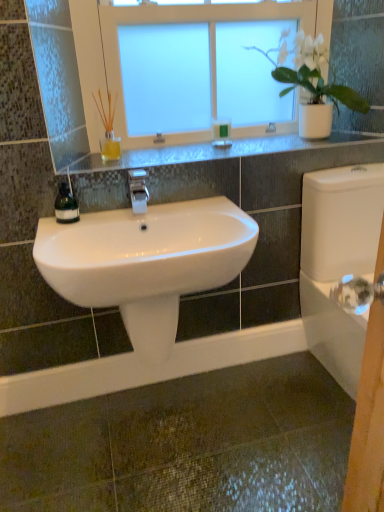
The height and width of the screenshot is (512, 384). What do you see at coordinates (66, 205) in the screenshot?
I see `green matte soap dispenser at left` at bounding box center [66, 205].

Where is `green matte soap at upper center`? Image resolution: width=384 pixels, height=512 pixels. green matte soap at upper center is located at coordinates (221, 134).

Describe the element at coordinates (338, 261) in the screenshot. I see `white glossy porcelain at right` at that location.

What is the approximate height of white matte pot at upper right?

16.82 inches.

What are the coordinates of `green matte soap dispenser at left` in the screenshot? It's located at (66, 205).

Is point (262, 53) less distant than point (358, 268)?

No, (262, 53) is further to viewer.

From a real-world perspective, which is physically below, white matte pot at upper right or white glossy porcelain at right?

white glossy porcelain at right.

Is white matte pot at upper right beside white glossy porcelain at right?

white matte pot at upper right and white glossy porcelain at right are clearly separated.

From the image's perspective, would you say white matte pot at upper right is positioned over white glossy porcelain at right?

Yes, from the image's perspective, white matte pot at upper right is on top of white glossy porcelain at right.

Does white frosted glass window at upper center come behind green matte soap at upper center?

No, white frosted glass window at upper center is closer to the camera.

Considering the sizes of objects white frosted glass window at upper center and green matte soap at upper center in the image provided, who is taller, white frosted glass window at upper center or green matte soap at upper center?

With more height is white frosted glass window at upper center.

Based on the photo, is white frosted glass window at upper center facing towards green matte soap at upper center?

Yes, white frosted glass window at upper center is turned towards green matte soap at upper center.

Looking at the image, does white frosted glass window at upper center seem bigger or smaller compared to green matte soap at upper center?

In the image, white frosted glass window at upper center appears to be larger than green matte soap at upper center.

Does white matte pot at upper right have a greater width compared to white frosted glass window at upper center?

Yes.

Which is correct: white matte pot at upper right is inside white frosted glass window at upper center, or outside of it?

white matte pot at upper right exists outside the volume of white frosted glass window at upper center.

Which object is positioned more to the left, white matte pot at upper right or white frosted glass window at upper center?

From the viewer's perspective, white frosted glass window at upper center appears more on the left side.

From the image's perspective, is white glossy sink at center positioned above or below green matte soap dispenser at left?

From the image's perspective, white glossy sink at center appears below green matte soap dispenser at left.

Is white glossy sink at center not close to green matte soap dispenser at left?

No, white glossy sink at center is not far away from green matte soap dispenser at left.

In the scene shown: Is white glossy sink at center turned away from green matte soap dispenser at left?

No, green matte soap dispenser at left is not at the back of white glossy sink at center.

What's the angular difference between white glossy sink at center and green matte soap dispenser at left's facing directions?

The facing directions of white glossy sink at center and green matte soap dispenser at left are 3.4 degrees apart.

Could you tell me if green matte soap dispenser at left is facing white matte pot at upper right?

No, green matte soap dispenser at left is not facing towards white matte pot at upper right.

From the image's perspective, would you say green matte soap dispenser at left is positioned over white matte pot at upper right?

Actually, green matte soap dispenser at left appears below white matte pot at upper right in the image.

From a real-world perspective, is green matte soap dispenser at left beneath white matte pot at upper right?

Yes, from a real-world perspective, green matte soap dispenser at left is below white matte pot at upper right.

Can you tell me how much green matte soap dispenser at left and white matte pot at upper right differ in facing direction?

There is a 2.65-degree angle between the facing directions of green matte soap dispenser at left and white matte pot at upper right.

Based on the photo, is green matte soap dispenser at left at the back of white glossy porcelain at right?

No, green matte soap dispenser at left is not at the back of white glossy porcelain at right.

Considering the sizes of objects white glossy porcelain at right and green matte soap dispenser at left in the image provided, who is shorter, white glossy porcelain at right or green matte soap dispenser at left?

green matte soap dispenser at left is shorter.

Is white glossy porcelain at right located outside green matte soap dispenser at left?

Indeed, white glossy porcelain at right is completely outside green matte soap dispenser at left.

Is white glossy porcelain at right looking in the opposite direction of satin silver shelf at upper center?

No, white glossy porcelain at right's orientation is not away from satin silver shelf at upper center.

Can we say white glossy porcelain at right lies outside satin silver shelf at upper center?

Indeed, white glossy porcelain at right is completely outside satin silver shelf at upper center.

Consider the image. Considering the sizes of white glossy porcelain at right and satin silver shelf at upper center in the image, is white glossy porcelain at right taller or shorter than satin silver shelf at upper center?

Considering their sizes, white glossy porcelain at right has more height than satin silver shelf at upper center.

Identify the location of houseplant on the left of white glossy porcelain at right. (311, 73).

You are a GUI agent. You are given a task and a screenshot of the screen. Output one action in this format:
    pyautogui.click(x=<x>, y=<y>)
    Task: Click on the window above the green matte soap at upper center (from a real-world perspective)
    
    Given the screenshot: What is the action you would take?
    pyautogui.click(x=188, y=23)

When comparing their distances from white glossy faucet at center, does white frosted glass window at upper center or white glossy sink at center seem further?

Based on the image, white frosted glass window at upper center appears to be further to white glossy faucet at center.

Considering their positions, is white glossy sink at center positioned closer to white frosted glass window at upper center than satin silver shelf at upper center?

satin silver shelf at upper center is positioned closer to the anchor white frosted glass window at upper center.

Consider the image. Which object lies further to the anchor point green matte soap at upper center, white glossy sink at center or white glossy porcelain at right?

Based on the image, white glossy porcelain at right appears to be further to green matte soap at upper center.

Consider the image. Based on their spatial positions, is white matte pot at upper right or green matte soap dispenser at left closer to white glossy porcelain at right?

The object closer to white glossy porcelain at right is white matte pot at upper right.

From the image, which object appears to be nearer to white glossy sink at center, white frosted glass window at upper center or white glossy faucet at center?

white glossy faucet at center.

Looking at the image, which one is located closer to green matte soap dispenser at left, white matte pot at upper right or green matte soap at upper center?

green matte soap at upper center is positioned closer to the anchor green matte soap dispenser at left.

Looking at this image, which object lies nearer to the anchor point white glossy sink at center, white frosted glass window at upper center or white glossy porcelain at right?

white glossy porcelain at right is positioned closer to the anchor white glossy sink at center.

From the image, which object appears to be nearer to white matte pot at upper right, white glossy sink at center or white glossy porcelain at right?

Based on the image, white glossy porcelain at right appears to be nearer to white matte pot at upper right.

This screenshot has width=384, height=512. I want to click on soap dispenser that lies between white glossy faucet at center and white glossy sink at center from top to bottom, so click(66, 205).

You are a GUI agent. You are given a task and a screenshot of the screen. Output one action in this format:
    pyautogui.click(x=<x>, y=<y>)
    Task: Click on the window sill between green matte soap dispenser at left and white glossy porcelain at right
    The image size is (384, 512).
    Given the screenshot: What is the action you would take?
    pyautogui.click(x=228, y=151)

At what (x,y) coordinates should I click in order to perform the action: click on window sill between white glossy faucet at center and white matte pot at upper right. Please return your answer as a coordinate pair (x, y). The height and width of the screenshot is (512, 384). Looking at the image, I should click on (228, 151).

This screenshot has height=512, width=384. What are the coordinates of `window sill between white frosted glass window at upper center and white glossy porcelain at right in the vertical direction` in the screenshot? It's located at (228, 151).